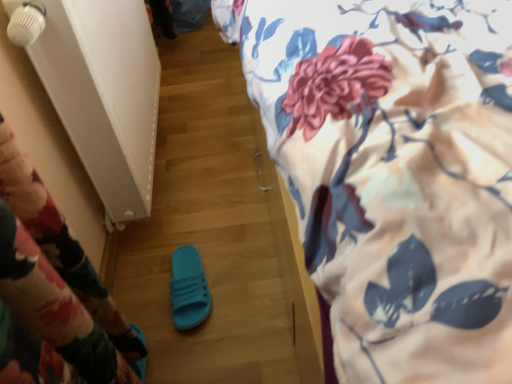
Question: Should I look upward or downward to see teal rubber slipper at center?

Choices:
 (A) up
 (B) down

Answer: (B)

Question: Does floral fabric bed at upper right have a greater height compared to teal rubber slipper at center?

Choices:
 (A) no
 (B) yes

Answer: (B)

Question: Is floral fabric bed at upper right looking in the opposite direction of teal rubber slipper at center?

Choices:
 (A) no
 (B) yes

Answer: (A)

Question: Is floral fabric bed at upper right bigger than teal rubber slipper at center?

Choices:
 (A) no
 (B) yes

Answer: (B)

Question: Can you confirm if floral fabric bed at upper right is shorter than teal rubber slipper at center?

Choices:
 (A) yes
 (B) no

Answer: (B)

Question: Would you say floral fabric bed at upper right is outside teal rubber slipper at center?

Choices:
 (A) yes
 (B) no

Answer: (A)

Question: Does floral fabric bed at upper right appear on the left side of teal rubber slipper at center?

Choices:
 (A) no
 (B) yes

Answer: (A)

Question: From a real-world perspective, is teal rubber slipper at center positioned under floral fabric bed at upper right based on gravity?

Choices:
 (A) no
 (B) yes

Answer: (B)

Question: Can you confirm if teal rubber slipper at center is wider than floral fabric bed at upper right?

Choices:
 (A) no
 (B) yes

Answer: (A)

Question: Is teal rubber slipper at center in front of floral fabric bed at upper right?

Choices:
 (A) no
 (B) yes

Answer: (A)

Question: Is the depth of teal rubber slipper at center greater than that of floral fabric bed at upper right?

Choices:
 (A) no
 (B) yes

Answer: (B)

Question: Is teal rubber slipper at center at the right side of floral fabric bed at upper right?

Choices:
 (A) no
 (B) yes

Answer: (A)

Question: Is teal rubber slipper at center positioned with its back to floral fabric bed at upper right?

Choices:
 (A) yes
 (B) no

Answer: (B)

Question: Is point (497, 31) positioned closer to the camera than point (197, 256)?

Choices:
 (A) farther
 (B) closer

Answer: (B)